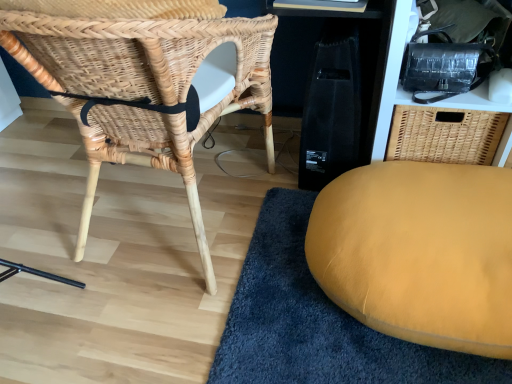
The width and height of the screenshot is (512, 384). Find the location of `free region under natural woven chair at left (from a real-world perspective)`. free region under natural woven chair at left (from a real-world perspective) is located at coordinates (180, 216).